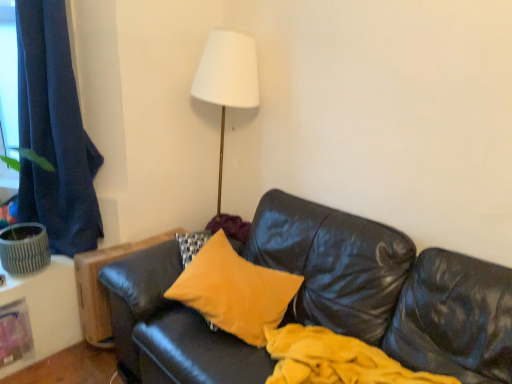
Question: Looking at their shapes, would you say dark blue fabric curtain at left is wider or thinner than velvet yellow pillow at center?

Choices:
 (A) wide
 (B) thin

Answer: (B)

Question: Is dark blue fabric curtain at left taller or shorter than velvet yellow pillow at center?

Choices:
 (A) short
 (B) tall

Answer: (B)

Question: Would you say dark blue fabric curtain at left is to the left or to the right of velvet yellow pillow at center in the picture?

Choices:
 (A) right
 (B) left

Answer: (B)

Question: Based on their positions, is velvet yellow pillow at center located to the left or right of dark blue fabric curtain at left?

Choices:
 (A) left
 (B) right

Answer: (B)

Question: Is velvet yellow pillow at center bigger or smaller than dark blue fabric curtain at left?

Choices:
 (A) small
 (B) big

Answer: (A)

Question: Is point (202, 312) positioned closer to the camera than point (51, 34)?

Choices:
 (A) farther
 (B) closer

Answer: (B)

Question: From the image's perspective, is velvet yellow pillow at center located above or below dark blue fabric curtain at left?

Choices:
 (A) below
 (B) above

Answer: (A)